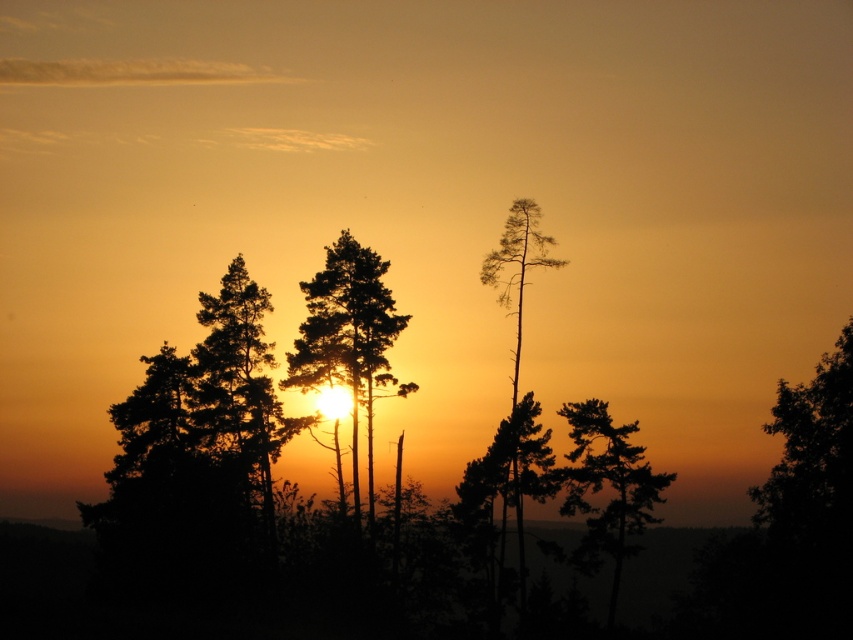
Which is above, dark green leafy tree at right or silhouette wood at right?

Positioned higher is silhouette wood at right.

Which is in front, point (811, 428) or point (514, 465)?

Point (811, 428) is more forward.

The height and width of the screenshot is (640, 853). Describe the element at coordinates (811, 456) in the screenshot. I see `dark green leafy tree at right` at that location.

The width and height of the screenshot is (853, 640). Identify the location of dark green leafy tree at right. (811, 456).

Looking at this image, is silhouette tree at center above silhouette wood at right?

Correct, silhouette tree at center is located above silhouette wood at right.

Where is `silhouette tree at center`? The height and width of the screenshot is (640, 853). silhouette tree at center is located at coordinates [x=347, y=339].

Between point (814, 524) and point (378, 369), which one is positioned in front?

Positioned in front is point (814, 524).

Between point (822, 460) and point (345, 260), which one is positioned behind?

The point (345, 260) is behind.

Find the location of `dark green leafy tree at right`. dark green leafy tree at right is located at coordinates (811, 456).